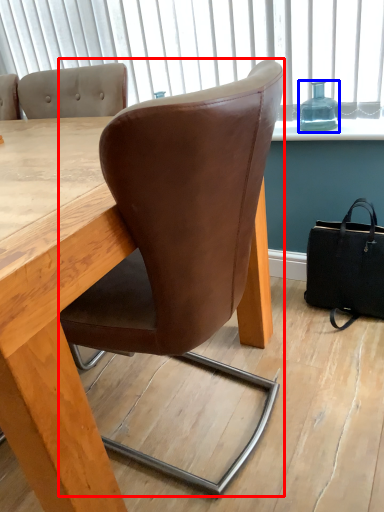
Question: Which of the following is the farthest to the observer, chair (highlighted by a red box) or bottle (highlighted by a blue box)?

Choices:
 (A) chair
 (B) bottle

Answer: (B)